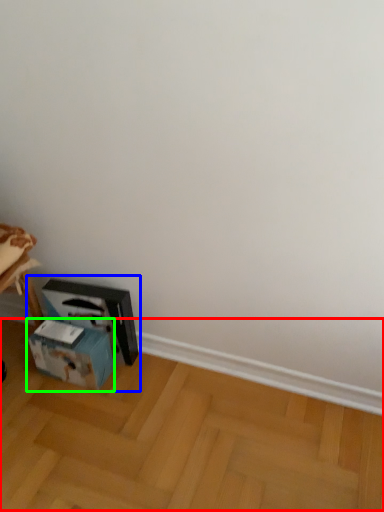
Question: Which object is the closest to the wood (highlighted by a red box)? Choose among these: workbench (highlighted by a blue box) or box (highlighted by a green box).

Choices:
 (A) workbench
 (B) box

Answer: (A)